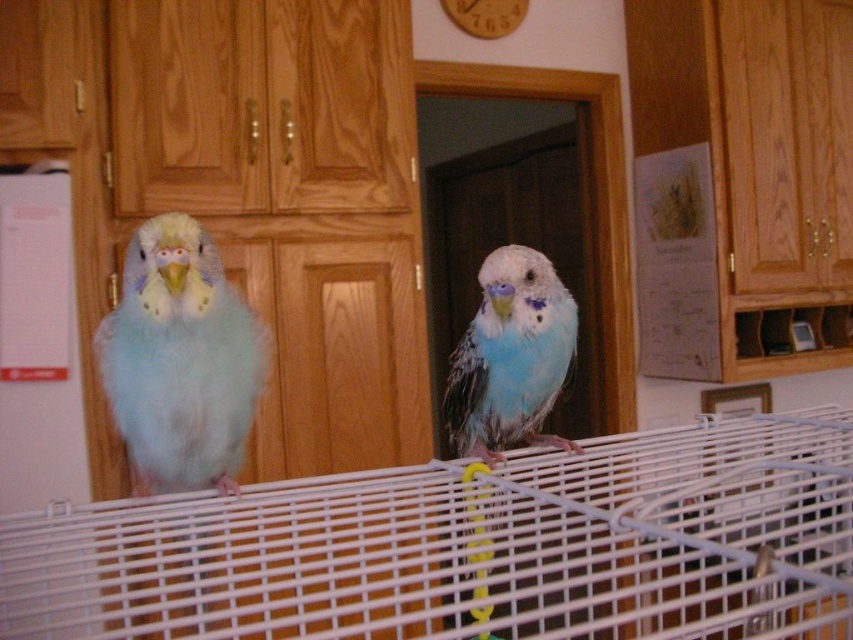
You are a bird enthusiast observing the scene. You notice the white wire cage at center and the light blue feathered parrot at center. Which object is located to the right of the other?

The white wire cage at center is positioned on the right side of the light blue feathered parrot at center, so the white wire cage at center is to the right of the light blue feathered parrot at center.

You are standing in front of the cage with two parakeets. There are two points marked on the cage. Which point is closer to you, point (799, 426) or point (465, 356)?

Point (799, 426) is closer to you because it is further to the viewer than point (465, 356).